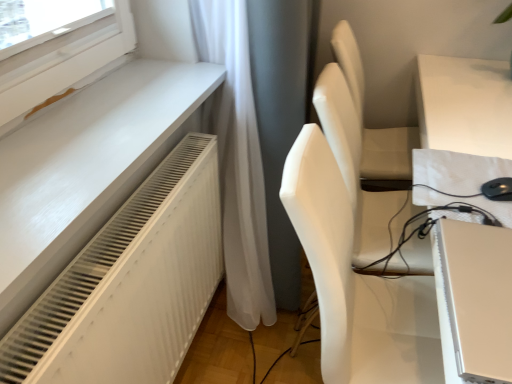
Question: Can you confirm if matte white table at right is thinner than satin gold laptop at lower right?

Choices:
 (A) yes
 (B) no

Answer: (B)

Question: Can you confirm if matte white table at right is smaller than satin gold laptop at lower right?

Choices:
 (A) no
 (B) yes

Answer: (A)

Question: Would you say matte white table at right is a long distance from satin gold laptop at lower right?

Choices:
 (A) yes
 (B) no

Answer: (B)

Question: From a real-world perspective, is matte white table at right under satin gold laptop at lower right?

Choices:
 (A) yes
 (B) no

Answer: (A)

Question: Is matte white table at right completely or partially outside of satin gold laptop at lower right?

Choices:
 (A) no
 (B) yes

Answer: (B)

Question: From the image's perspective, is white matte chair at center positioned above or below satin gold laptop at lower right?

Choices:
 (A) above
 (B) below

Answer: (B)

Question: Which is correct: white matte chair at center is inside satin gold laptop at lower right, or outside of it?

Choices:
 (A) inside
 (B) outside

Answer: (B)

Question: Considering the positions of white matte chair at center and satin gold laptop at lower right in the image, is white matte chair at center wider or thinner than satin gold laptop at lower right?

Choices:
 (A) wide
 (B) thin

Answer: (A)

Question: In the image, is white matte chair at center positioned in front of or behind satin gold laptop at lower right?

Choices:
 (A) behind
 (B) front

Answer: (A)

Question: In the image, is white textured radiator at lower left on the left side or the right side of satin gold laptop at lower right?

Choices:
 (A) left
 (B) right

Answer: (A)

Question: Considering the positions of point (202, 218) and point (446, 271), is point (202, 218) closer or farther from the camera than point (446, 271)?

Choices:
 (A) farther
 (B) closer

Answer: (A)

Question: Is white textured radiator at lower left spatially inside satin gold laptop at lower right, or outside of it?

Choices:
 (A) outside
 (B) inside

Answer: (A)

Question: Is white textured radiator at lower left in front of or behind satin gold laptop at lower right in the image?

Choices:
 (A) behind
 (B) front

Answer: (B)

Question: Does point (354, 342) appear closer or farther from the camera than point (416, 100)?

Choices:
 (A) closer
 (B) farther

Answer: (A)

Question: From the image's perspective, is white matte chair at center positioned above or below matte white table at right?

Choices:
 (A) below
 (B) above

Answer: (A)